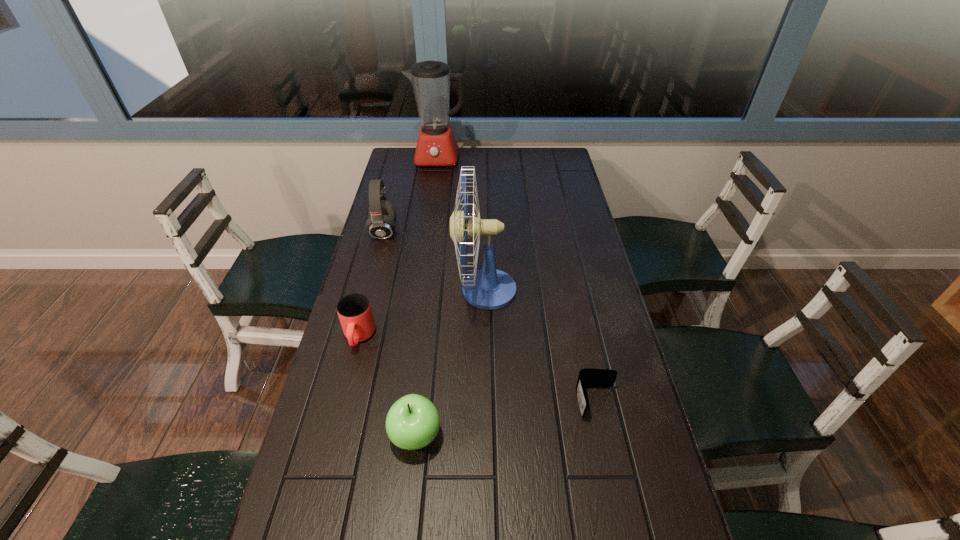
Identify the location of the farthest object. (436, 146).

The image size is (960, 540). Find the location of `fan`. fan is located at coordinates (488, 288).

The width and height of the screenshot is (960, 540). I want to click on headset, so click(381, 223).

I want to click on the second farthest object, so click(381, 223).

Find the location of a particular element. The image size is (960, 540). apple is located at coordinates click(x=412, y=422).

Find the location of a particular element. cup is located at coordinates pos(355,314).

At what (x,y) coordinates should I click in order to perform the action: click on wallet. Please return your answer as a coordinate pair (x, y). Looking at the image, I should click on tap(589, 376).

You are a GUI agent. You are given a task and a screenshot of the screen. Output one action in this format:
    pyautogui.click(x=<x>, y=<y>)
    Task: Click on the shortest object
    The height and width of the screenshot is (540, 960).
    Given the screenshot: What is the action you would take?
    pyautogui.click(x=589, y=376)

The height and width of the screenshot is (540, 960). In order to click on free region located on the front of the farthest object near the controls in this screenshot , I will do `click(432, 198)`.

Find the location of a particular element. vacant region located at the front of the fan where the blades are visible is located at coordinates (363, 290).